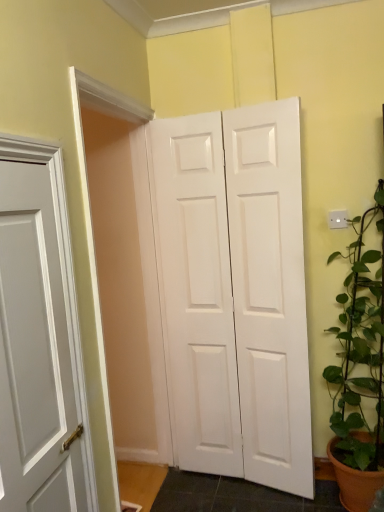
Question: Is green leafy plant at right not within white matte door at center?

Choices:
 (A) no
 (B) yes

Answer: (B)

Question: Is green leafy plant at right to the left of white matte door at center from the viewer's perspective?

Choices:
 (A) yes
 (B) no

Answer: (B)

Question: From a real-world perspective, is green leafy plant at right positioned under white matte door at center based on gravity?

Choices:
 (A) yes
 (B) no

Answer: (A)

Question: Is green leafy plant at right facing away from white matte door at center?

Choices:
 (A) no
 (B) yes

Answer: (A)

Question: Is green leafy plant at right at the right side of white matte door at center?

Choices:
 (A) yes
 (B) no

Answer: (A)

Question: Is white matte door at center located within green leafy plant at right?

Choices:
 (A) yes
 (B) no

Answer: (B)

Question: From a real-world perspective, is white matte door at center beneath green leafy plant at right?

Choices:
 (A) no
 (B) yes

Answer: (A)

Question: Is the depth of white matte door at center greater than that of green leafy plant at right?

Choices:
 (A) no
 (B) yes

Answer: (B)

Question: Is white matte door at center smaller than green leafy plant at right?

Choices:
 (A) no
 (B) yes

Answer: (B)

Question: Is white matte door at center turned away from green leafy plant at right?

Choices:
 (A) yes
 (B) no

Answer: (B)

Question: Is white matte door at center aimed at green leafy plant at right?

Choices:
 (A) yes
 (B) no

Answer: (B)

Question: Does white matte door at center have a greater height compared to green leafy plant at right?

Choices:
 (A) no
 (B) yes

Answer: (B)

Question: From a real-world perspective, is green leafy plant at right physically located above or below white matte door at center?

Choices:
 (A) below
 (B) above

Answer: (A)